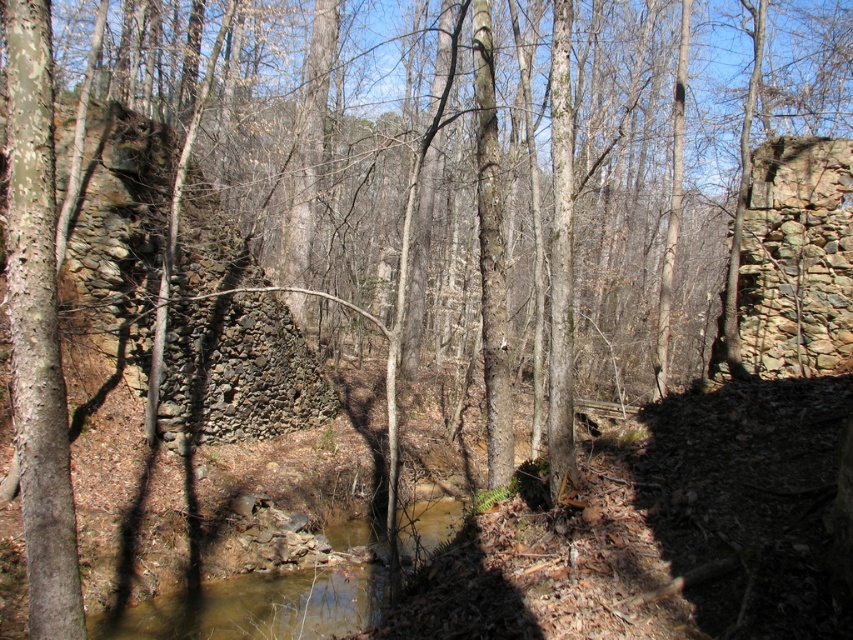
Question: Can you confirm if rusty stone wall at right is smaller than brown muddy water at center?

Choices:
 (A) no
 (B) yes

Answer: (A)

Question: Among these objects, which one is farthest from the camera?

Choices:
 (A) brown muddy water at center
 (B) rusty stone wall at right
 (C) dark gray stone wall at left

Answer: (C)

Question: Which object is closer to the camera taking this photo?

Choices:
 (A) dark gray stone wall at left
 (B) rusty stone wall at right
 (C) brown muddy water at center

Answer: (C)

Question: Can you confirm if rusty stone wall at right is bigger than brown muddy water at center?

Choices:
 (A) yes
 (B) no

Answer: (A)

Question: Which point is closer to the camera taking this photo?

Choices:
 (A) (762, 216)
 (B) (229, 294)
 (C) (215, 589)

Answer: (C)

Question: Is dark gray stone wall at left thinner than brown muddy water at center?

Choices:
 (A) yes
 (B) no

Answer: (A)